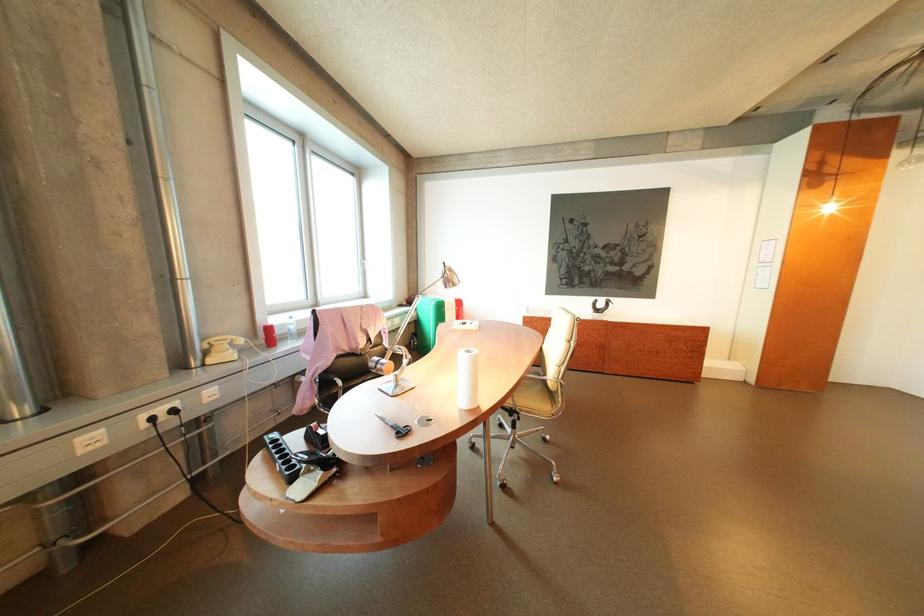
I want to click on window handle, so click(363, 264).